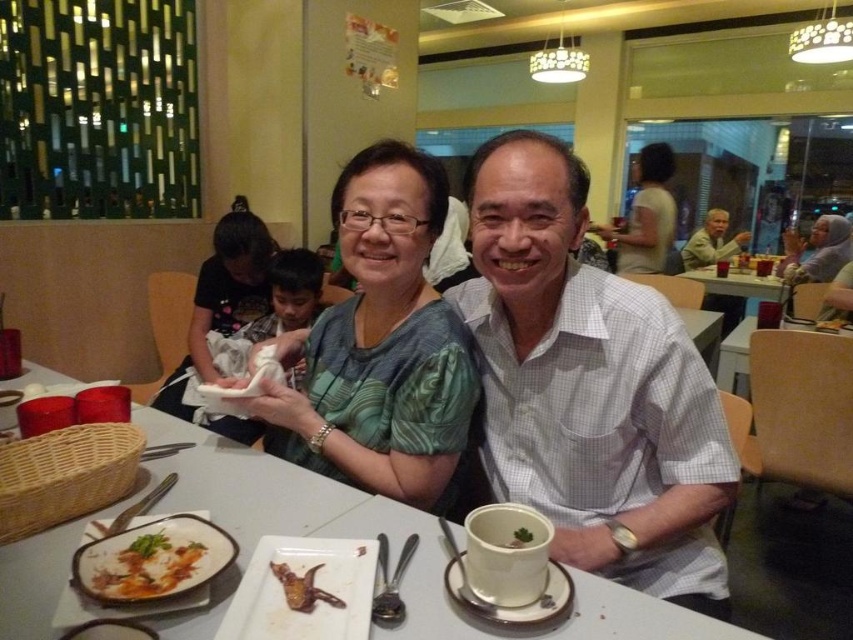
Question: Where is white glossy table at center located in relation to white glossy plate at lower left in the image?

Choices:
 (A) left
 (B) right

Answer: (B)

Question: Is white checkered shirt at center above matte white shirt at upper center?

Choices:
 (A) yes
 (B) no

Answer: (B)

Question: Which of the following is the farthest from the observer?

Choices:
 (A) (372, 484)
 (B) (178, 545)
 (C) (334, 524)

Answer: (A)

Question: Which point is closer to the camera?

Choices:
 (A) green leafy garnish at cup center
 (B) matte white shirt at upper center

Answer: (A)

Question: Can you confirm if white ceramic plate at center is wider than matte black shirt at center?

Choices:
 (A) no
 (B) yes

Answer: (A)

Question: Which point is farther to the camera?

Choices:
 (A) green leafy garnish at cup center
 (B) white ceramic plate at center

Answer: (A)